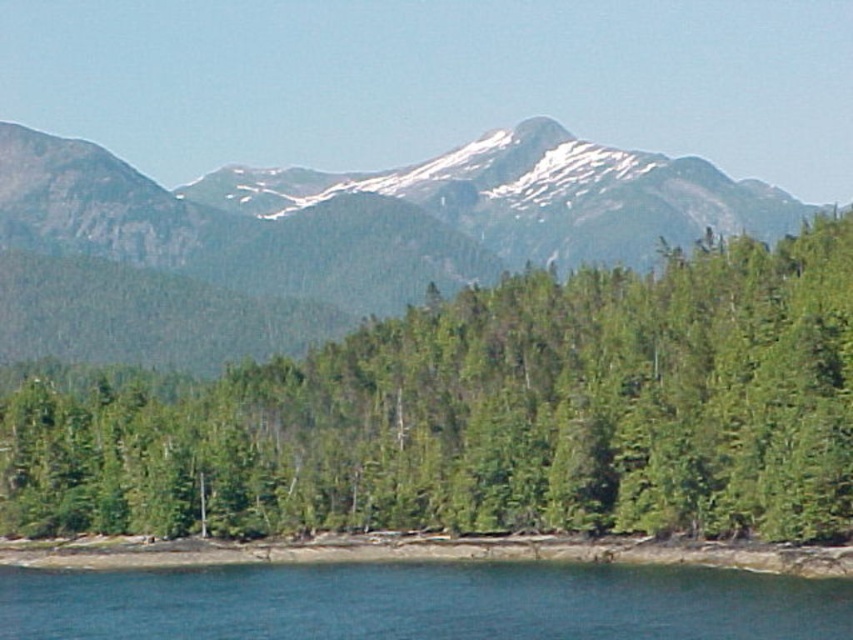
Question: Does green matte tree at center appear under brown dirt shoreline at lower center?

Choices:
 (A) no
 (B) yes

Answer: (A)

Question: Estimate the real-world distances between objects in this image. Which object is farther from the green forested mountain at upper center?

Choices:
 (A) brown dirt shoreline at lower center
 (B) clear blue water at lower center

Answer: (B)

Question: Is clear blue water at lower center bigger than brown dirt shoreline at lower center?

Choices:
 (A) no
 (B) yes

Answer: (B)

Question: Estimate the real-world distances between objects in this image. Which object is farther from the clear blue water at lower center?

Choices:
 (A) green matte tree at center
 (B) green forested mountain at upper center
 (C) brown dirt shoreline at lower center

Answer: (B)

Question: Among these points, which one is nearest to the camera?

Choices:
 (A) (596, 448)
 (B) (606, 189)
 (C) (698, 566)

Answer: (C)

Question: Observing the image, what is the correct spatial positioning of green matte tree at center in reference to brown dirt shoreline at lower center?

Choices:
 (A) left
 (B) right

Answer: (B)